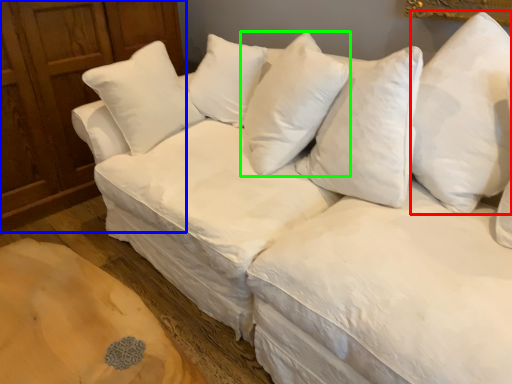
Question: Considering the real-world distances, which object is closest to pillow (highlighted by a red box)? dresser (highlighted by a blue box) or pillow (highlighted by a green box).

Choices:
 (A) dresser
 (B) pillow

Answer: (B)